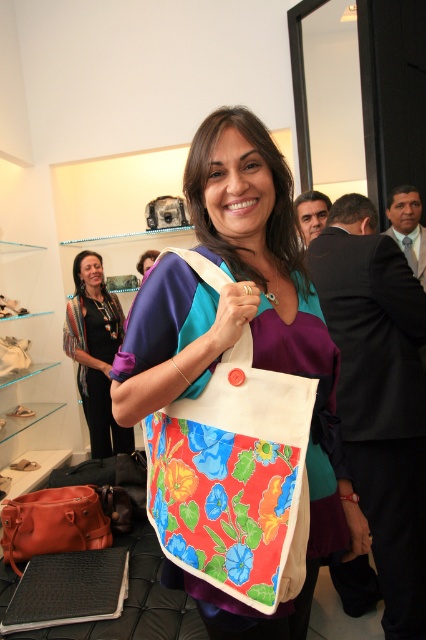
You are a customer in a store and want to choose between the floral fabric bag at center and the leather handbag at center. Which one can hold more items based on their size?

The floral fabric bag at center has a larger size compared to the leather handbag at center, so it can hold more items.

In the scene shown: You are a photographer standing in front of the floral fabric bag at center. You want to take a closeup shot of the bag without moving it. Your camera has a minimum focusing distance of 30 inches. Can you take the photo without moving the camera or the bag?

The floral fabric bag at center and camera are 32.91 inches apart. Since the minimum focusing distance is 30 inches, the camera can focus on the floral fabric bag at center from that distance, so yes, you can take the photo without moving either.